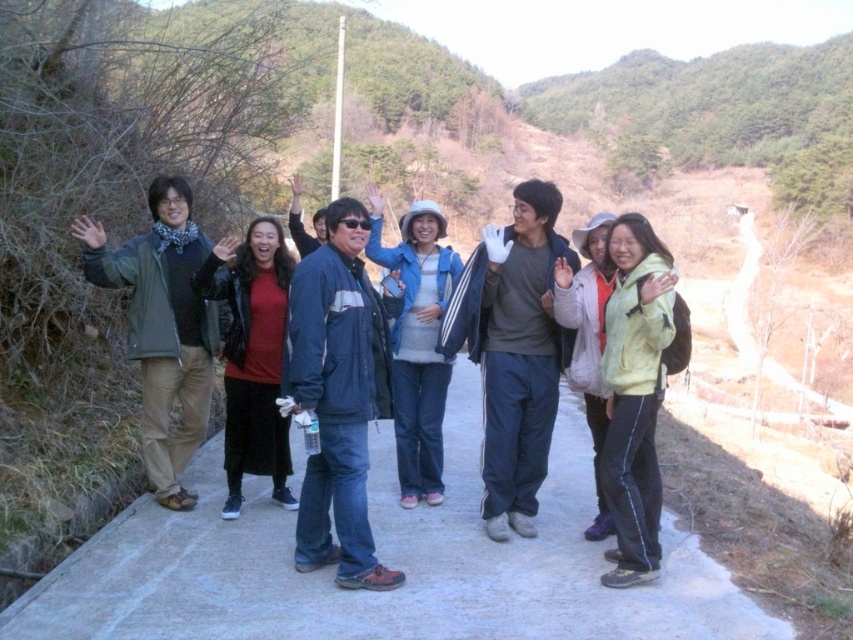
Does matte green jacket at left appear under denim jacket at center?

Actually, matte green jacket at left is above denim jacket at center.

Who is taller, matte green jacket at left or denim jacket at center?

matte green jacket at left is taller.

Is point (183, 328) positioned after point (418, 346)?

No, (183, 328) is closer to viewer.

Image resolution: width=853 pixels, height=640 pixels. I want to click on matte green jacket at left, so click(163, 326).

Can you confirm if matte green jacket at left is positioned above matte black jacket at center?

Yes.

Can you confirm if matte green jacket at left is smaller than matte black jacket at center?

No, matte green jacket at left is not smaller than matte black jacket at center.

Between point (102, 232) and point (233, 516), which one is positioned in front?

Point (102, 232)

I want to click on matte green jacket at left, so click(163, 326).

Who is more forward, (325, 419) or (258, 253)?

Point (325, 419)

Can you confirm if blue denim jacket at center is thinner than matte black jacket at center?

Indeed, blue denim jacket at center has a lesser width compared to matte black jacket at center.

Which is behind, point (349, 476) or point (270, 310)?

The point (270, 310) is more distant.

This screenshot has width=853, height=640. Identify the location of blue denim jacket at center. (338, 396).